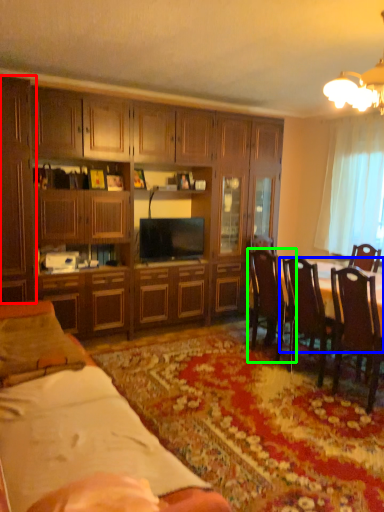
Question: Which object is positioned farthest from cabinetry (highlighted by a red box)? Select from round table (highlighted by a blue box) and chair (highlighted by a green box).

Choices:
 (A) round table
 (B) chair

Answer: (A)